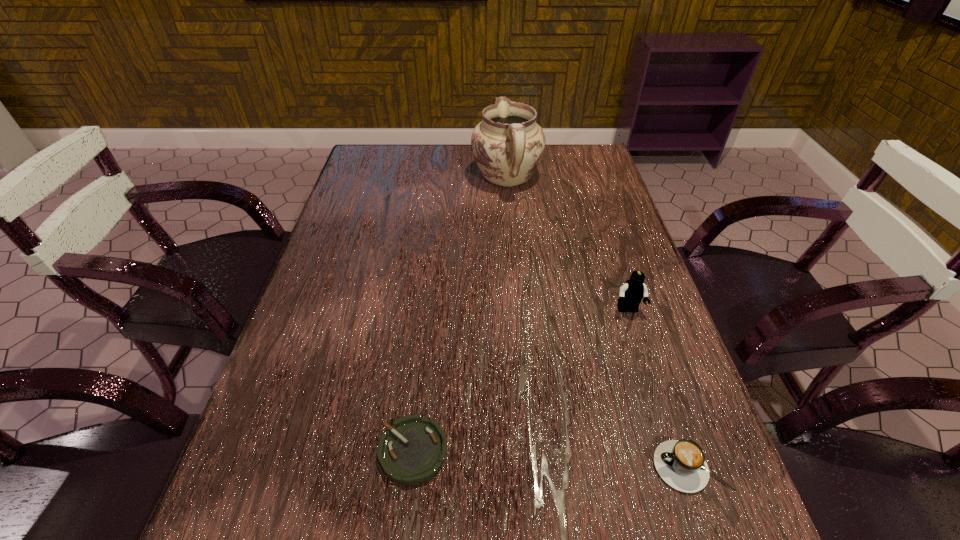
At what (x,y) coordinates should I click in order to perform the action: click on the third object from right to left. Please return your answer as a coordinate pair (x, y). The width and height of the screenshot is (960, 540). Looking at the image, I should click on (508, 145).

Locate an element on the screen. Image resolution: width=960 pixels, height=540 pixels. the farthest object is located at coordinates (508, 145).

The image size is (960, 540). I want to click on the second farthest object, so click(x=631, y=293).

The width and height of the screenshot is (960, 540). What are the coordinates of `Lego` in the screenshot? It's located at (631, 293).

This screenshot has width=960, height=540. In order to click on cappuccino in this screenshot , I will do `click(681, 464)`.

At what (x,y) coordinates should I click in order to perform the action: click on the leftmost object. Please return your answer as a coordinate pair (x, y). The height and width of the screenshot is (540, 960). Looking at the image, I should click on (413, 449).

Locate an element on the screen. This screenshot has height=540, width=960. ashtray is located at coordinates (413, 449).

I want to click on vacant space located on the spout of the pitcher, so click(504, 148).

Locate an element on the screen. The image size is (960, 540). free space located 0.390m on the front-facing side of the third shortest object is located at coordinates (693, 514).

Identify the location of free space located 0.150m with the handle on the side of the second shortest object. Image resolution: width=960 pixels, height=540 pixels. (562, 467).